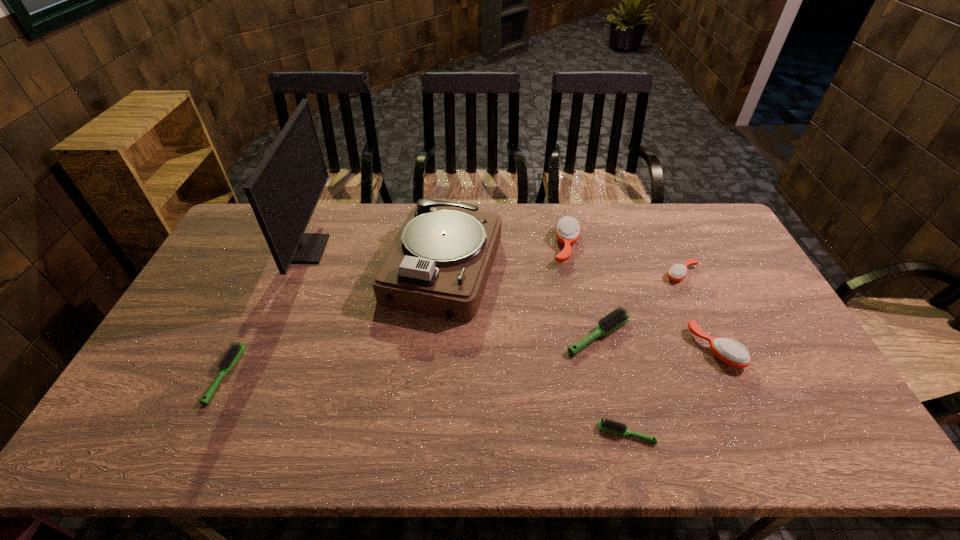
Image resolution: width=960 pixels, height=540 pixels. I want to click on free space located on the left of the shortest hairbrush, so click(x=465, y=433).

I want to click on computer monitor present at the far edge, so click(x=283, y=191).

Locate an element on the screen. The height and width of the screenshot is (540, 960). record player present at the far edge is located at coordinates (439, 263).

Find the location of `hairbrush at the far edge`. hairbrush at the far edge is located at coordinates (567, 230).

Locate an element on the screen. This screenshot has height=540, width=960. object that is at the near edge is located at coordinates (610, 426).

At what (x,y) coordinates should I click in order to perform the action: click on vacant area at the far edge. Please return your answer as a coordinate pair (x, y). Looking at the image, I should click on (678, 240).

Identify the location of free point at the near edge. Image resolution: width=960 pixels, height=540 pixels. (x=561, y=421).

Find the location of a particular element. Image resolution: width=960 pixels, height=540 pixels. vacant area at the left edge is located at coordinates (237, 289).

In the image, there is a desktop. Where is `vacant space at the right edge`? The height and width of the screenshot is (540, 960). vacant space at the right edge is located at coordinates (749, 298).

Find the location of a particular element. This screenshot has height=540, width=960. blank space at the near left corner is located at coordinates (156, 447).